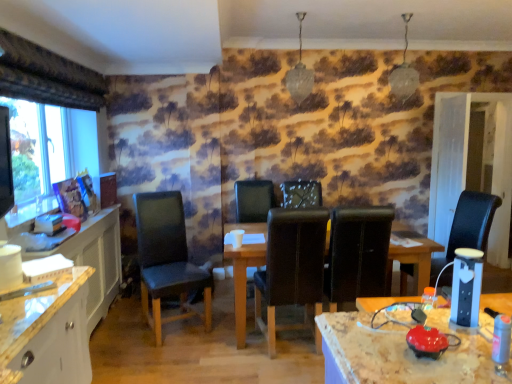
Locate an element on the screen. This screenshot has width=512, height=384. vacant area to the left of leather at center, arranged as the 2th chair when viewed from the left is located at coordinates (221, 354).